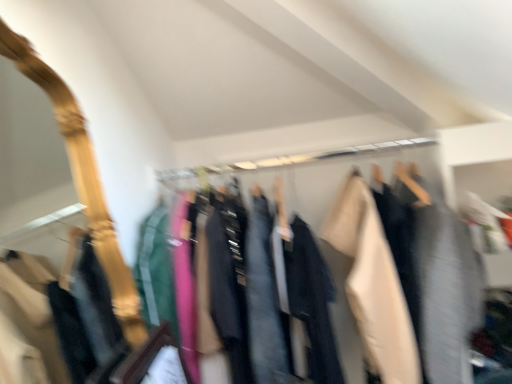
Identify the location of textured fabric clothes at center. (405, 290).

Describe the element at coordinates (405, 290) in the screenshot. I see `textured fabric clothes at center` at that location.

Where is `textured fabric clothes at center`? This screenshot has width=512, height=384. textured fabric clothes at center is located at coordinates (405, 290).